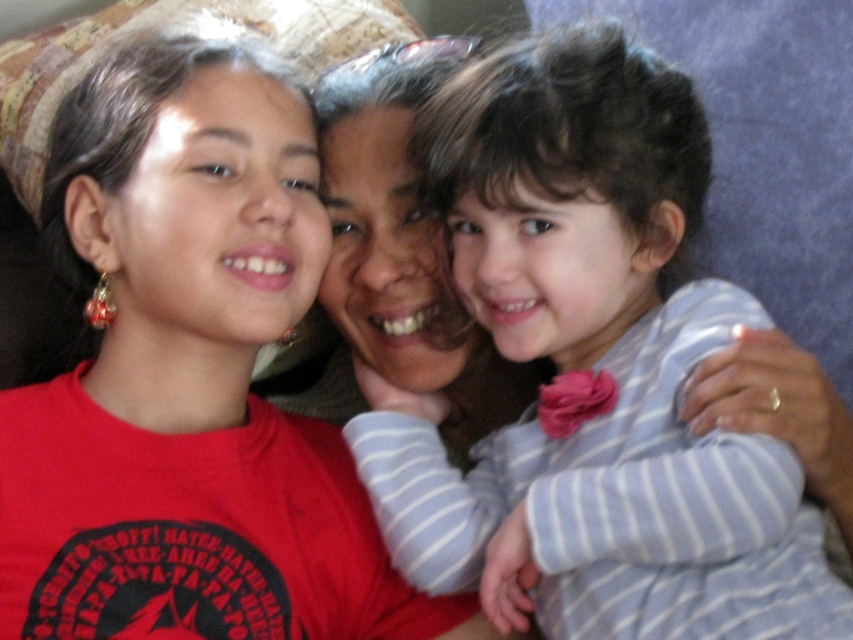
Question: Is the position of striped fabric dress at center more distant than that of matte brown hair at center?

Choices:
 (A) no
 (B) yes

Answer: (A)

Question: Among these points, which one is farthest from the camera?

Choices:
 (A) (3, 504)
 (B) (694, 538)

Answer: (A)

Question: Does striped fabric dress at center have a greater width compared to matte brown hair at center?

Choices:
 (A) no
 (B) yes

Answer: (A)

Question: Which of the following is the closest to the observer?

Choices:
 (A) (169, 605)
 (B) (677, 173)

Answer: (A)

Question: Can you confirm if striped fabric dress at center is bigger than matte brown hair at center?

Choices:
 (A) yes
 (B) no

Answer: (A)